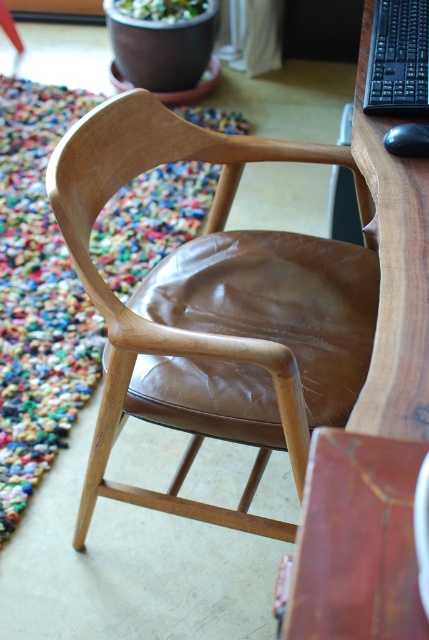
In the scene shown: Between brown leather armchair at center and black plastic keyboard at upper right, which one is positioned higher?

Positioned higher is black plastic keyboard at upper right.

Does brown leather armchair at center have a greater height compared to black plastic keyboard at upper right?

Yes, brown leather armchair at center is taller than black plastic keyboard at upper right.

Describe the element at coordinates (217, 312) in the screenshot. I see `brown leather armchair at center` at that location.

Identify the location of brown leather armchair at center. (217, 312).

Does point (256, 433) come behind point (375, 410)?

Yes, it is.

The height and width of the screenshot is (640, 429). Describe the element at coordinates (217, 312) in the screenshot. I see `brown leather armchair at center` at that location.

Locate an element on the screen. The height and width of the screenshot is (640, 429). brown leather armchair at center is located at coordinates (217, 312).

Between wooden computer desk at right and black plastic keyboard at upper right, which one has more height?

wooden computer desk at right is taller.

Is the position of wooden computer desk at right more distant than that of black plastic keyboard at upper right?

No, wooden computer desk at right is closer to the viewer.

What do you see at coordinates (393, 273) in the screenshot? I see `wooden computer desk at right` at bounding box center [393, 273].

Identify the location of wooden computer desk at right. (393, 273).